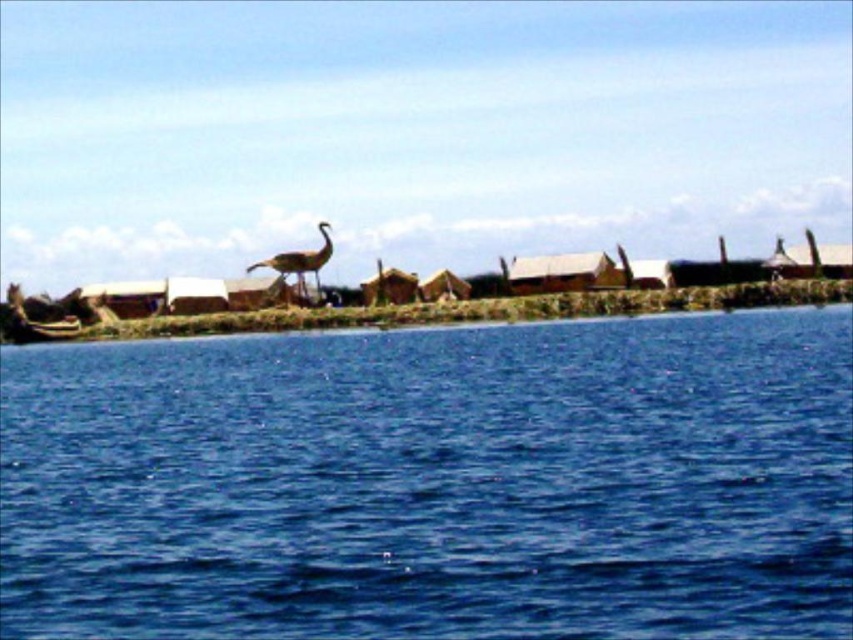
Question: Is blue water at center below brown feathered bird at center?

Choices:
 (A) no
 (B) yes

Answer: (B)

Question: Which point is farther to the camera?

Choices:
 (A) brown feathered bird at center
 (B) blue water at center

Answer: (A)

Question: Which point is farther from the camera taking this photo?

Choices:
 (A) (300, 282)
 (B) (38, 588)

Answer: (A)

Question: Observing the image, what is the correct spatial positioning of blue water at center in reference to brown feathered bird at center?

Choices:
 (A) below
 (B) above

Answer: (A)

Question: Does blue water at center have a larger size compared to brown feathered bird at center?

Choices:
 (A) no
 (B) yes

Answer: (B)